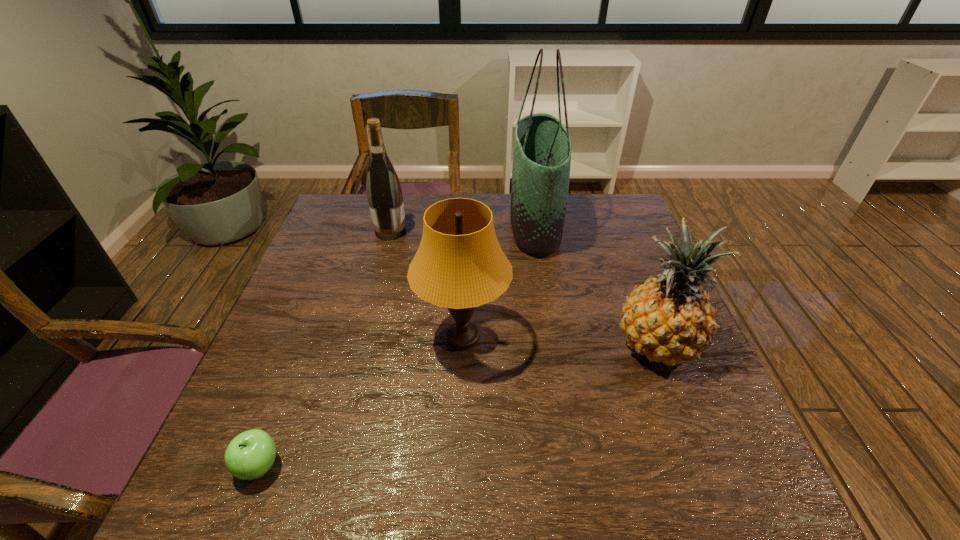
Identify which object is located as the second nearest to the tote bag. Please provide its 2D coordinates. Your answer should be formatted as a tuple, i.e. [(x, y)], where the tuple contains the x and y coordinates of a point satisfying the conditions above.

[(669, 319)]

The width and height of the screenshot is (960, 540). Identify the location of object that is the third closest one to the third object from right to left. (249, 455).

The width and height of the screenshot is (960, 540). I want to click on vacant region that satisfies the following two spatial constraints: 1. on the front side of the lampshade; 2. on the right side of the pineapple, so click(463, 345).

Image resolution: width=960 pixels, height=540 pixels. I want to click on vacant position in the image that satisfies the following two spatial constraints: 1. on the back side of the tallest object; 2. on the left side of the apple, so click(352, 224).

Locate an element on the screen. This screenshot has height=540, width=960. vacant space that satisfies the following two spatial constraints: 1. on the label of the wine bottle; 2. on the right side of the lampshade is located at coordinates (363, 338).

The height and width of the screenshot is (540, 960). What are the coordinates of `blank area in the image that satisfies the following two spatial constraints: 1. on the label of the wine bottle; 2. on the right side of the third object from right to left` in the screenshot? It's located at (363, 338).